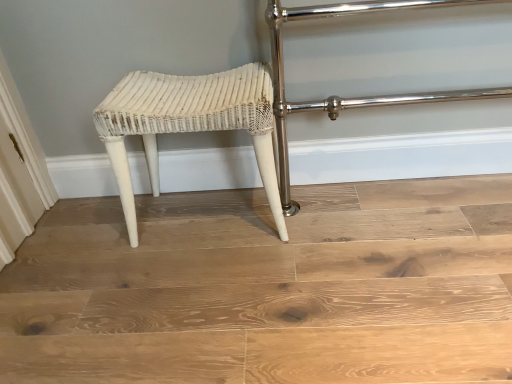
I want to click on free region under white wicker stool at center (from a real-world perspective), so click(x=211, y=215).